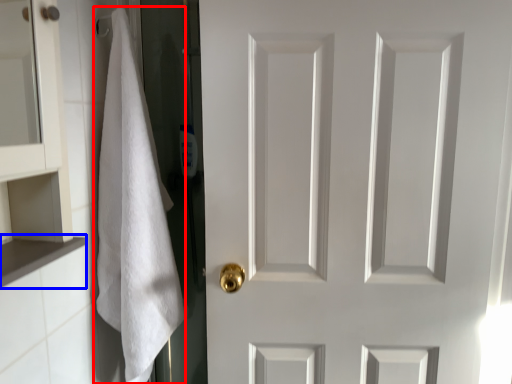
Question: Among these objects, which one is farthest to the camera, bath towel (highlighted by a red box) or cabinet (highlighted by a blue box)?

Choices:
 (A) bath towel
 (B) cabinet

Answer: (A)